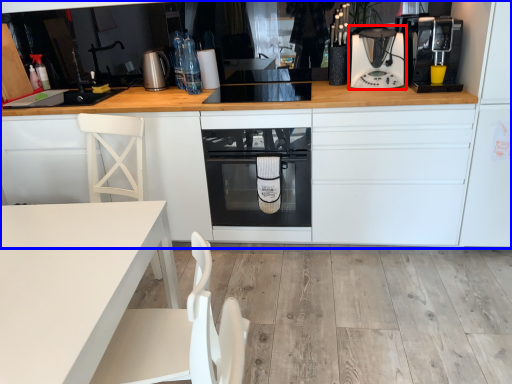
Question: Which of the following is the farthest to the observer, kitchen appliance (highlighted by a red box) or cabinetry (highlighted by a blue box)?

Choices:
 (A) kitchen appliance
 (B) cabinetry

Answer: (A)